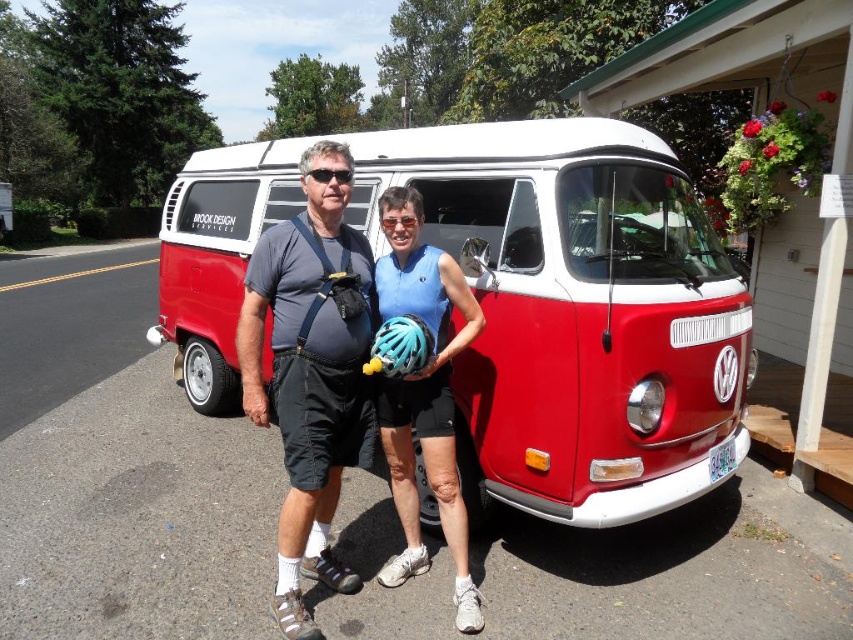
Is point (728, 330) closer to camera compared to point (267, 241)?

That is False.

From the picture: Is red matte van at center smaller than matte black helmet at center?

Correct, red matte van at center occupies less space than matte black helmet at center.

Who is more distant from viewer, (503, 436) or (351, 353)?

The point (503, 436) is more distant.

I want to click on red matte van at center, so click(576, 314).

Is matte black helmet at center shorter than teal matte bicycle helmet at center?

Incorrect, matte black helmet at center's height does not fall short of teal matte bicycle helmet at center's.

Between matte black helmet at center and teal matte bicycle helmet at center, which one has less height?

teal matte bicycle helmet at center is shorter.

Locate an element on the screen. The image size is (853, 640). matte black helmet at center is located at coordinates (312, 369).

Between blue matte helmet at center and teal matte bicycle helmet at center, which one is positioned lower?

Positioned lower is blue matte helmet at center.

Does blue matte helmet at center have a greater height compared to teal matte bicycle helmet at center?

Indeed, blue matte helmet at center has a greater height compared to teal matte bicycle helmet at center.

Find the location of a particular element. The height and width of the screenshot is (640, 853). blue matte helmet at center is located at coordinates (424, 396).